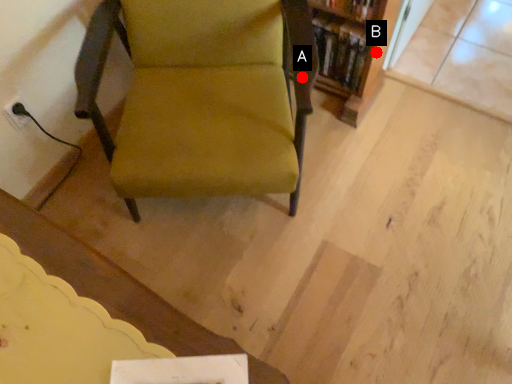
Question: Two points are circled on the image, labeled by A and B beside each circle. Which point appears farthest from the camera in this image?

Choices:
 (A) A is further
 (B) B is further

Answer: (B)